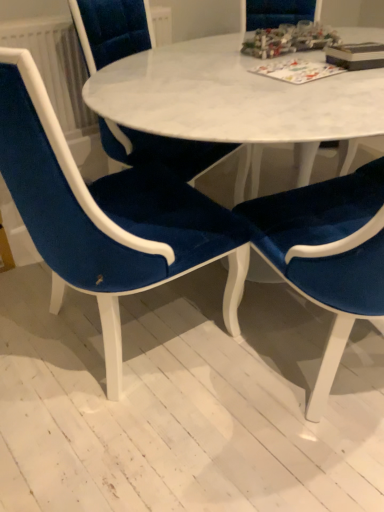
Find the location of a particular element. The width and height of the screenshot is (384, 512). vacant area that is in front of matte paper board game at upper center, acting as the first book starting from the left is located at coordinates (309, 89).